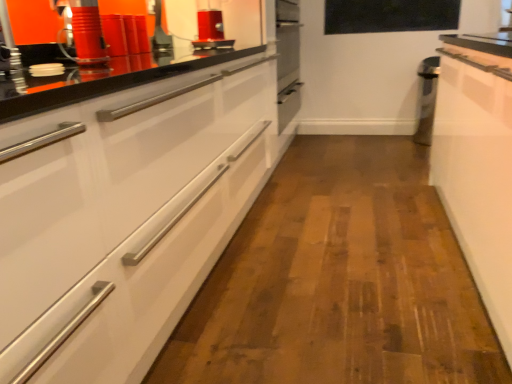
Question: From a real-world perspective, is black glass window screen at upper center over white glossy cabinet at right?

Choices:
 (A) yes
 (B) no

Answer: (A)

Question: Are black glass window screen at upper center and white glossy cabinet at right far apart?

Choices:
 (A) yes
 (B) no

Answer: (A)

Question: Is black glass window screen at upper center completely or partially outside of white glossy cabinet at right?

Choices:
 (A) no
 (B) yes

Answer: (B)

Question: From the image's perspective, does black glass window screen at upper center appear lower than white glossy cabinet at right?

Choices:
 (A) yes
 (B) no

Answer: (B)

Question: Can you confirm if black glass window screen at upper center is thinner than white glossy cabinet at right?

Choices:
 (A) yes
 (B) no

Answer: (A)

Question: Is black glass window screen at upper center taller than white glossy cabinet at right?

Choices:
 (A) yes
 (B) no

Answer: (B)

Question: From the image's perspective, is white glossy cabinet at left above matte red canister at upper left, the first appliance from the bottom?

Choices:
 (A) no
 (B) yes

Answer: (A)

Question: Is white glossy cabinet at left at the right side of matte red canister at upper left, the first appliance from the bottom?

Choices:
 (A) no
 (B) yes

Answer: (B)

Question: Is white glossy cabinet at left not inside matte red canister at upper left, which is the first appliance from left to right?

Choices:
 (A) yes
 (B) no

Answer: (A)

Question: Is white glossy cabinet at left oriented towards matte red canister at upper left, which is the first appliance in front-to-back order?

Choices:
 (A) yes
 (B) no

Answer: (B)

Question: Does white glossy cabinet at left have a larger size compared to matte red canister at upper left, which ranks as the 2th appliance in right-to-left order?

Choices:
 (A) no
 (B) yes

Answer: (B)

Question: From a real-world perspective, is white glossy cabinet at left on matte red canister at upper left, which is the first appliance in front-to-back order?

Choices:
 (A) no
 (B) yes

Answer: (A)

Question: Is black glass window screen at upper center thinner than matte red canister at upper left, which ranks as the 2th appliance in right-to-left order?

Choices:
 (A) no
 (B) yes

Answer: (B)